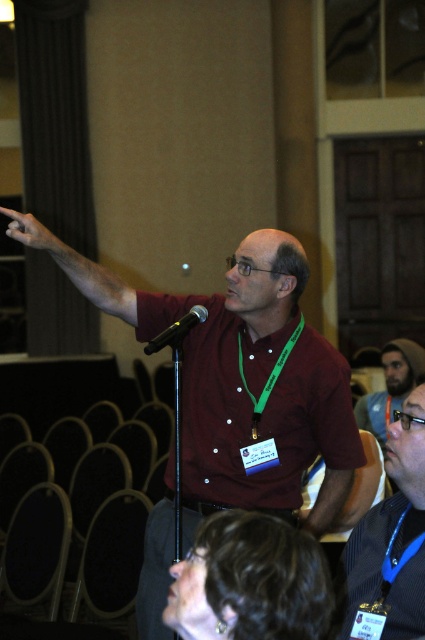
Does matte maroon shirt at center appear on the left side of black matte microphone at center?

No, matte maroon shirt at center is not to the left of black matte microphone at center.

Does matte maroon shirt at center have a greater width compared to black matte microphone at center?

Yes, matte maroon shirt at center is wider than black matte microphone at center.

Image resolution: width=425 pixels, height=640 pixels. What are the coordinates of `matte maroon shirt at center` in the screenshot? It's located at (246, 381).

Is dark brown hair at lower center bigger than blue lanyard at lower right?

No, dark brown hair at lower center is not bigger than blue lanyard at lower right.

Does point (278, 628) come farther from viewer compared to point (418, 468)?

That is False.

Between point (201, 556) and point (362, 593), which one is positioned in front?

Positioned in front is point (201, 556).

I want to click on dark brown hair at lower center, so click(251, 580).

Can you confirm if matte maroon shirt at center is positioned to the left of blue lanyard at lower right?

Yes, matte maroon shirt at center is to the left of blue lanyard at lower right.

Between point (285, 417) and point (410, 508), which one is positioned in front?

Point (410, 508)

At what (x,y) coordinates should I click in order to perform the action: click on matte maroon shirt at center. Please return your answer as a coordinate pair (x, y). The height and width of the screenshot is (640, 425). Looking at the image, I should click on (246, 381).